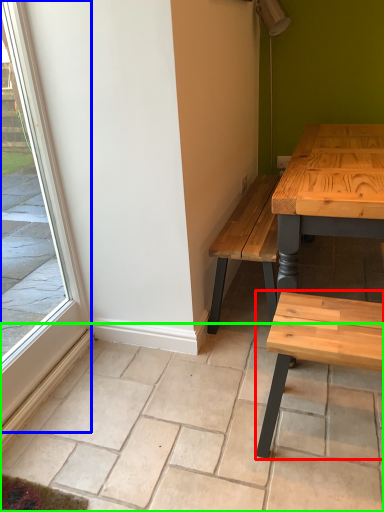
Question: Estimate the real-world distances between objects in this image. Which object is closer to coffee table (highlighted by a red box), window (highlighted by a blue box) or tile (highlighted by a green box)?

Choices:
 (A) window
 (B) tile

Answer: (B)